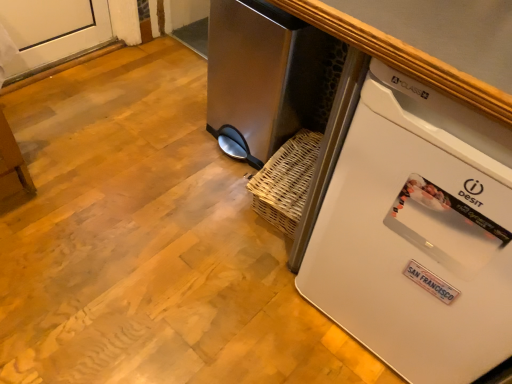
In order to click on white plastic refrigerator at lower right in this screenshot , I will do `click(417, 234)`.

What do you see at coordinates (417, 234) in the screenshot? The height and width of the screenshot is (384, 512). I see `white plastic refrigerator at lower right` at bounding box center [417, 234].

This screenshot has height=384, width=512. What do you see at coordinates (250, 75) in the screenshot?
I see `stainless steel trash can at center` at bounding box center [250, 75].

Where is `stainless steel trash can at center`? stainless steel trash can at center is located at coordinates (250, 75).

You are a GUI agent. You are given a task and a screenshot of the screen. Output one action in this format:
    pyautogui.click(x=<x>, y=<y>)
    Task: Click on the white plastic refrigerator at lower right
    Image resolution: width=512 pixels, height=384 pixels.
    Given the screenshot: What is the action you would take?
    pyautogui.click(x=417, y=234)

Can you confirm if stainless steel trash can at center is positioned to the right of white plastic refrigerator at lower right?

No.

Is the position of stainless steel trash can at center less distant than that of white plastic refrigerator at lower right?

No, it is not.

Considering the points (245, 79) and (397, 267), which point is behind, point (245, 79) or point (397, 267)?

Point (245, 79)

From the image's perspective, which one is positioned lower, stainless steel trash can at center or white plastic refrigerator at lower right?

From the image's view, white plastic refrigerator at lower right is below.

From a real-world perspective, which is physically above, stainless steel trash can at center or white plastic refrigerator at lower right?

white plastic refrigerator at lower right is physically above.

Which of these two, stainless steel trash can at center or white plastic refrigerator at lower right, is thinner?

stainless steel trash can at center.

Between stainless steel trash can at center and white plastic refrigerator at lower right, which one has more height?

With more height is white plastic refrigerator at lower right.

Can you confirm if stainless steel trash can at center is smaller than white plastic refrigerator at lower right?

Correct, stainless steel trash can at center occupies less space than white plastic refrigerator at lower right.

Is stainless steel trash can at center inside or outside of white plastic refrigerator at lower right?

stainless steel trash can at center is not inside white plastic refrigerator at lower right, it's outside.

Is stainless steel trash can at center directly adjacent to white plastic refrigerator at lower right?

No, stainless steel trash can at center is not making contact with white plastic refrigerator at lower right.

Is stainless steel trash can at center aimed at white plastic refrigerator at lower right?

No, stainless steel trash can at center is not turned towards white plastic refrigerator at lower right.

Can you tell me how much stainless steel trash can at center and white plastic refrigerator at lower right differ in facing direction?

The facing directions of stainless steel trash can at center and white plastic refrigerator at lower right are 0.00598 degrees apart.

How much distance is there between stainless steel trash can at center and white plastic refrigerator at lower right?

A distance of 69.64 centimeters exists between stainless steel trash can at center and white plastic refrigerator at lower right.

Where is `home appliance below the stainless steel trash can at center (from the image's perspective)`? home appliance below the stainless steel trash can at center (from the image's perspective) is located at coordinates (417, 234).

Considering the positions of objects white plastic refrigerator at lower right and stainless steel trash can at center in the image provided, who is more to the left, white plastic refrigerator at lower right or stainless steel trash can at center?

stainless steel trash can at center is more to the left.

Is white plastic refrigerator at lower right further to the viewer compared to stainless steel trash can at center?

No, it is in front of stainless steel trash can at center.

Which is more distant, (426,191) or (232,111)?

Point (232,111)

From the image's perspective, is white plastic refrigerator at lower right on stainless steel trash can at center?

Incorrect, from the image's perspective, white plastic refrigerator at lower right is lower than stainless steel trash can at center.

From a real-world perspective, who is located lower, white plastic refrigerator at lower right or stainless steel trash can at center?

stainless steel trash can at center, from a real-world perspective.

Is white plastic refrigerator at lower right wider than stainless steel trash can at center?

Yes, white plastic refrigerator at lower right is wider than stainless steel trash can at center.

Considering the relative sizes of white plastic refrigerator at lower right and stainless steel trash can at center in the image provided, is white plastic refrigerator at lower right taller than stainless steel trash can at center?

Correct, white plastic refrigerator at lower right is much taller as stainless steel trash can at center.

Can you confirm if white plastic refrigerator at lower right is bigger than stainless steel trash can at center?

A: Yes.

Is white plastic refrigerator at lower right not within stainless steel trash can at center?

Yes, white plastic refrigerator at lower right is located beyond the bounds of stainless steel trash can at center.

Is white plastic refrigerator at lower right next to stainless steel trash can at center?

No, white plastic refrigerator at lower right is not with stainless steel trash can at center.

Is white plastic refrigerator at lower right turned away from stainless steel trash can at center?

No, white plastic refrigerator at lower right is not facing away from stainless steel trash can at center.

What are the coordinates of `home appliance above the stainless steel trash can at center (from a real-world perspective)` in the screenshot? It's located at (417, 234).

Find the location of a particular element. This screenshot has height=384, width=512. home appliance that appears on the right of stainless steel trash can at center is located at coordinates (417, 234).

Where is `appliance on the left of white plastic refrigerator at lower right`? The width and height of the screenshot is (512, 384). appliance on the left of white plastic refrigerator at lower right is located at coordinates (250, 75).